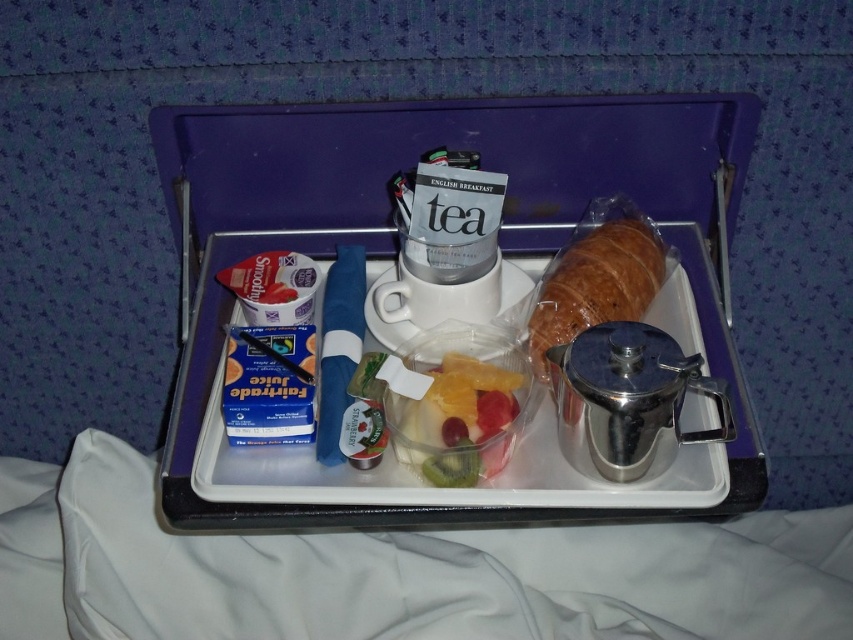
You are a hotel guest who wants to pick up the golden brown croissant at right from the metallic silver tray at center. Is the croissant on top of the tray or underneath it?

The metallic silver tray at center is located below golden brown croissant at right, so the croissant is on top of the tray.

You are standing in front of the breakfast tray and want to reach both points on the tray. Which point, point (x=196, y=129) or point (x=471, y=428), is closer to you?

Point (x=196, y=129) is closer to you because it is further to the viewer than point (x=471, y=428).